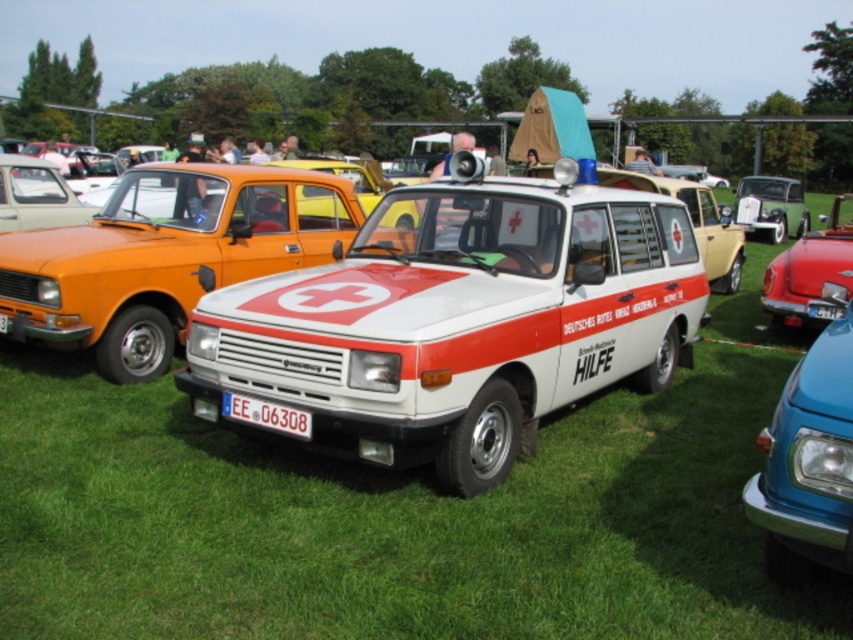
You are standing in the middle of the vintage car exhibition. There is a point at coordinates (459, 321). Which object is this point located on?

The point at coordinates (459, 321) is located on the white matte van at center.

In the scene shown: You are a photographer setting up a shot of the blue glossy van at center and the shiny red car at right. If you want to capture both vehicles in focus, which one should you position closer to the camera to ensure depth of field?

The blue glossy van at center is already closer to the viewer than the shiny red car at right. To ensure both are in focus, position the blue glossy van at center closer to the camera since it is nearer, allowing the depth of field to cover the distance between them.